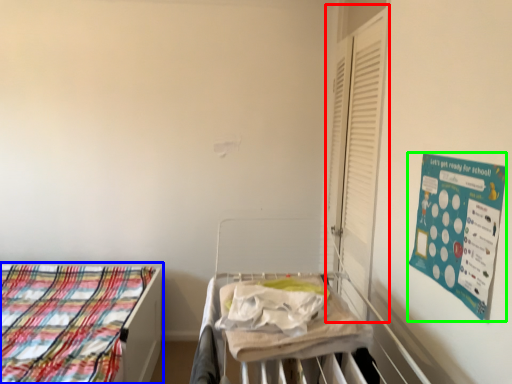
Question: Which object is positioned farthest from shutter (highlighted by a red box)? Select from bed (highlighted by a blue box) and poster (highlighted by a green box).

Choices:
 (A) bed
 (B) poster

Answer: (A)